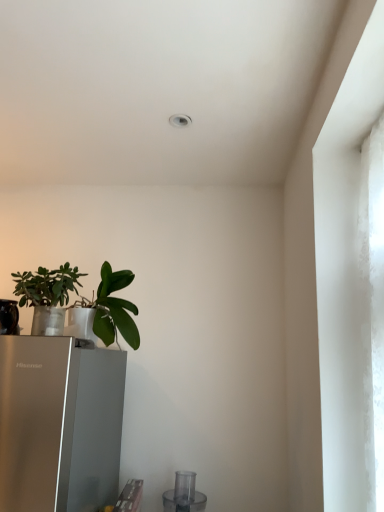
Question: Is transparent plastic blender at lower center turned away from green matte plant at left, the first houseplant when ordered from left to right?

Choices:
 (A) yes
 (B) no

Answer: (B)

Question: Does transparent plastic blender at lower center come behind green matte plant at left, acting as the 2th houseplant starting from the right?

Choices:
 (A) no
 (B) yes

Answer: (B)

Question: Would you consider transparent plastic blender at lower center to be distant from green matte plant at left, the first houseplant when ordered from left to right?

Choices:
 (A) yes
 (B) no

Answer: (B)

Question: From the image's perspective, does transparent plastic blender at lower center appear lower than green matte plant at left, the first houseplant when ordered from left to right?

Choices:
 (A) no
 (B) yes

Answer: (B)

Question: Considering the relative positions of transparent plastic blender at lower center and green matte plant at left, the first houseplant when ordered from left to right, in the image provided, is transparent plastic blender at lower center to the left of green matte plant at left, the first houseplant when ordered from left to right, from the viewer's perspective?

Choices:
 (A) no
 (B) yes

Answer: (A)

Question: Is transparent plastic blender at lower center in contact with green matte plant at left, acting as the 2th houseplant starting from the right?

Choices:
 (A) no
 (B) yes

Answer: (A)

Question: Is green matte plant at left, acting as the 2th houseplant starting from the right, behind transparent plastic blender at lower center?

Choices:
 (A) no
 (B) yes

Answer: (A)

Question: Is green matte plant at left, the first houseplant when ordered from left to right, taller than transparent plastic blender at lower center?

Choices:
 (A) yes
 (B) no

Answer: (A)

Question: From the image's perspective, does green matte plant at left, acting as the 2th houseplant starting from the right, appear higher than transparent plastic blender at lower center?

Choices:
 (A) no
 (B) yes

Answer: (B)

Question: Is green matte plant at left, acting as the 2th houseplant starting from the right, surrounding transparent plastic blender at lower center?

Choices:
 (A) yes
 (B) no

Answer: (B)

Question: Is green matte plant at left, acting as the 2th houseplant starting from the right, not close to transparent plastic blender at lower center?

Choices:
 (A) no
 (B) yes

Answer: (A)

Question: From a real-world perspective, does green matte plant at left, acting as the 2th houseplant starting from the right, stand above transparent plastic blender at lower center?

Choices:
 (A) no
 (B) yes

Answer: (B)

Question: From the image's perspective, is green matte plant at left, the first houseplant when ordered from left to right, over green matte leafy plant at lower left, which is the 2th houseplant in left-to-right order?

Choices:
 (A) no
 (B) yes

Answer: (B)